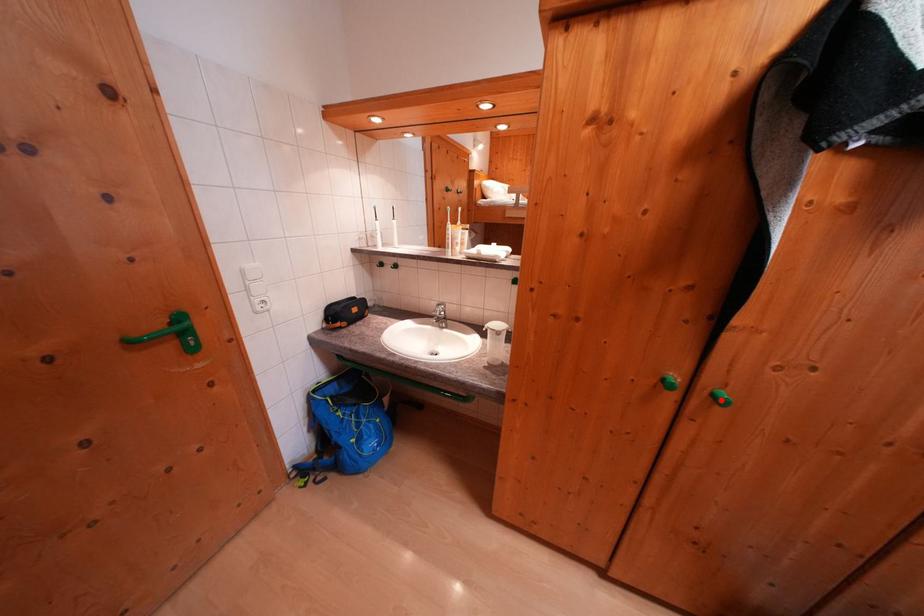
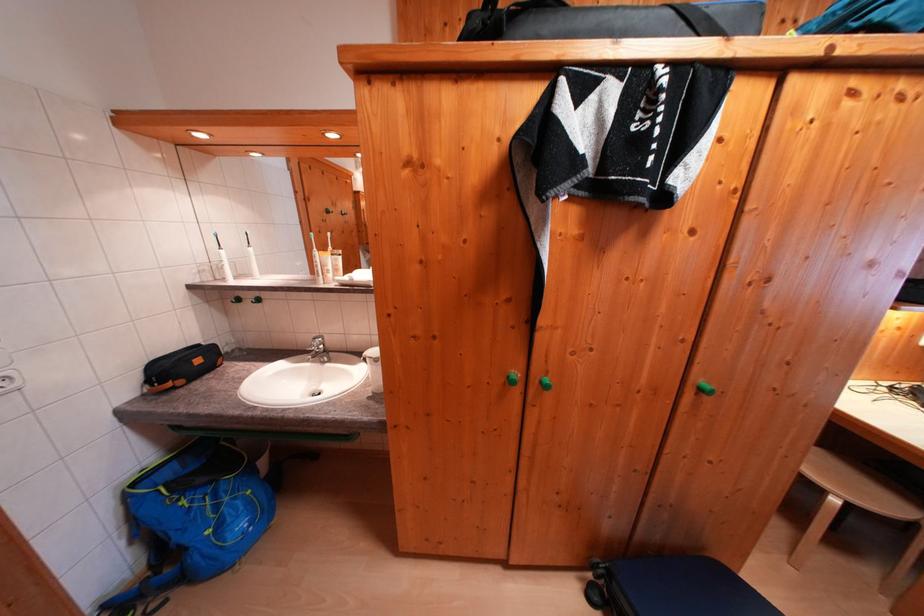
In the second image, find the point that corresponds to the highlighted location in the first image.

(550, 387)